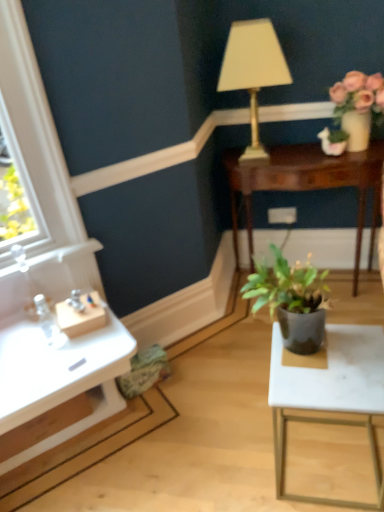
Identify the location of vacant region above white marble table at lower right, which is the first table from bottom to top (from a real-world perspective). (331, 372).